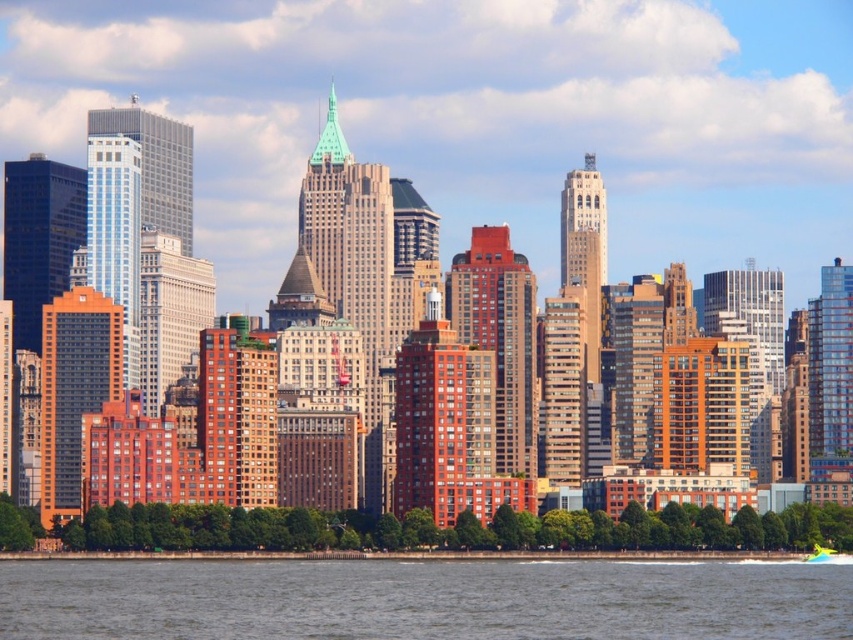
You are a photographer trying to capture the entire scene of the city skyline. You notice the gray water at lower center and the green plastic boat at lower right. Which object takes up more space in the photo?

The gray water at lower center takes up more space in the photo because it is larger in size than the green plastic boat at lower right according to the description.

You are standing at the center of the image and want to find the gray water at lower center. According to the coordinates provided, in which direction should you look to locate it?

The gray water at lower center is located at coordinates point (422, 600), so you should look to the right to locate it.